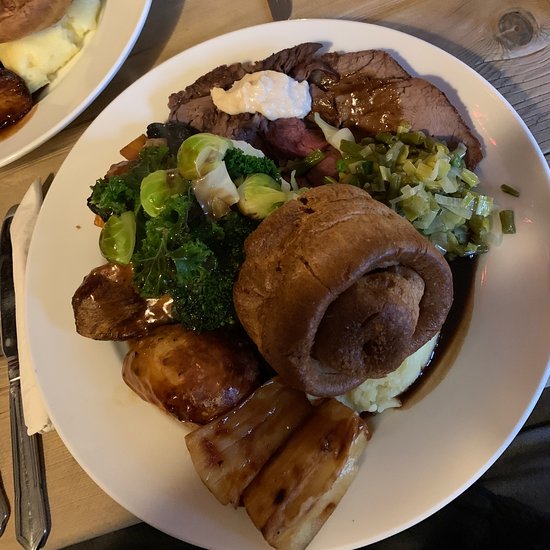
Locate an element on the screen. This screenshot has height=550, width=550. table is located at coordinates (515, 45).